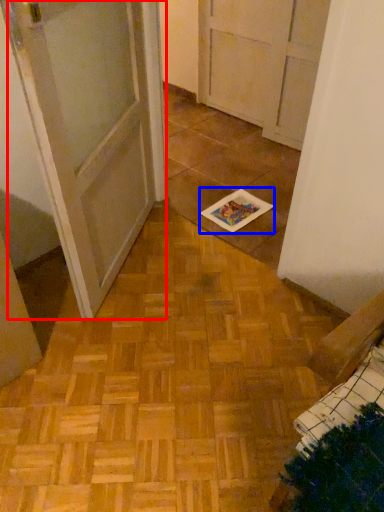
Question: Which of the following is the closest to the observer, door (highlighted by a red box) or book (highlighted by a blue box)?

Choices:
 (A) door
 (B) book

Answer: (A)